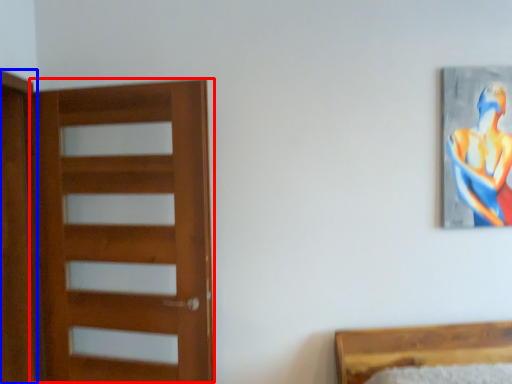
Question: Which object is further to the camera taking this photo, door (highlighted by a red box) or screen door (highlighted by a blue box)?

Choices:
 (A) door
 (B) screen door

Answer: (B)